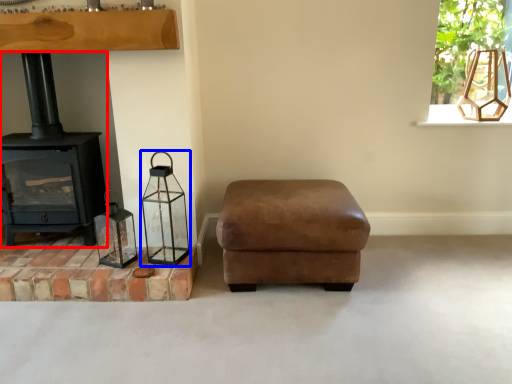
Question: Which object appears closest to the camera in this image, wood burning stove (highlighted by a red box) or candle holder (highlighted by a blue box)?

Choices:
 (A) wood burning stove
 (B) candle holder

Answer: (B)